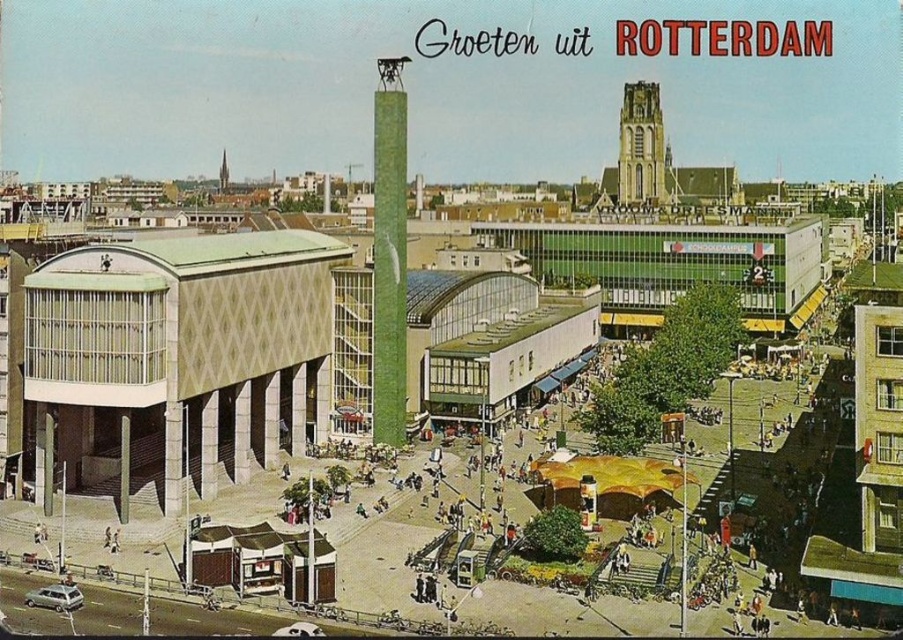
Question: Where is green textured tower at center located in relation to green stone tower at upper right in the image?

Choices:
 (A) below
 (B) above

Answer: (A)

Question: Considering the relative positions of green textured tower at center and green stone tower at upper right in the image provided, where is green textured tower at center located with respect to green stone tower at upper right?

Choices:
 (A) left
 (B) right

Answer: (A)

Question: Which object appears closest to the camera in this image?

Choices:
 (A) green stone tower at upper right
 (B) green textured tower at center

Answer: (B)

Question: Can you confirm if green textured tower at center is positioned to the right of green stone tower at upper right?

Choices:
 (A) yes
 (B) no

Answer: (B)